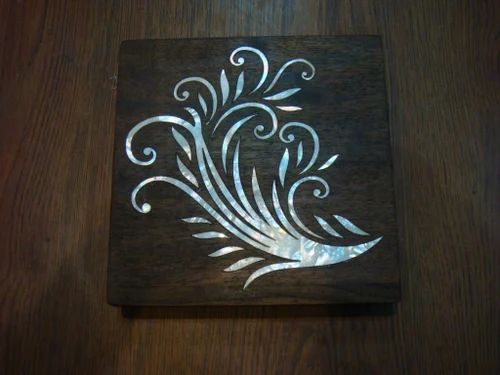
The width and height of the screenshot is (500, 375). I want to click on center of wooden plank, so (x=251, y=145).